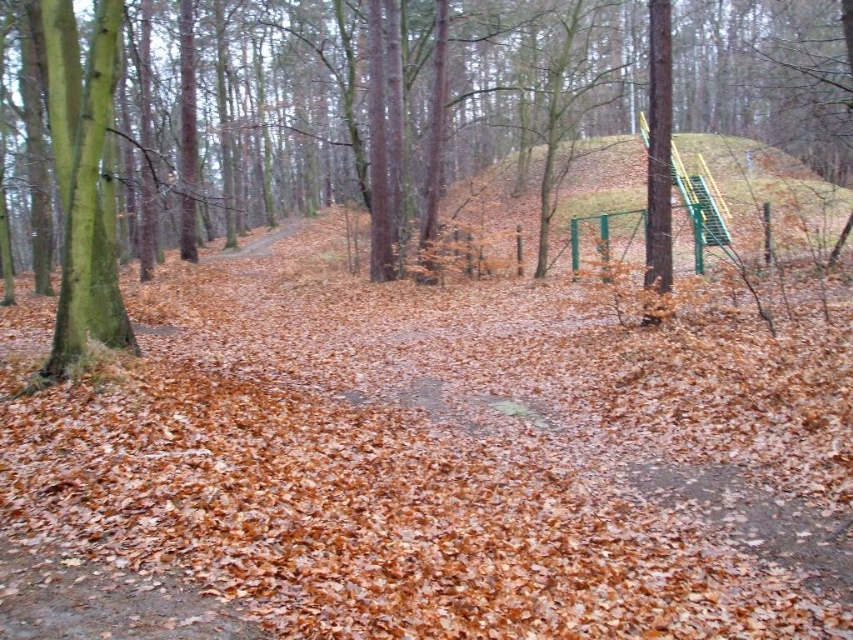
You are standing at the base of the forest path and see two points marked in the scene. The first point is at coordinates point (x=83, y=298) and the second is at point (x=715, y=208). Which point is closer to you as you face the forest?

Point (x=83, y=298) is in front of point (x=715, y=208), so it is closer to you.

You are a hiker who wants to take a photo of both the green rough bark tree at left and the green metallic slide at upper right in the same frame. Which object should you focus on first to ensure both are in focus?

You should focus on the green rough bark tree at left first since it is closer to the viewer than the green metallic slide at upper right, allowing both to be in focus when using depth of field appropriately.